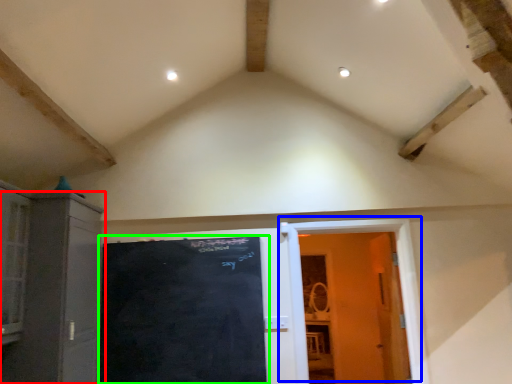
Question: Estimate the real-world distances between objects in this image. Which object is closer to cabinetry (highlighted by a red box), door (highlighted by a blue box) or bulletin board (highlighted by a green box)?

Choices:
 (A) door
 (B) bulletin board

Answer: (B)